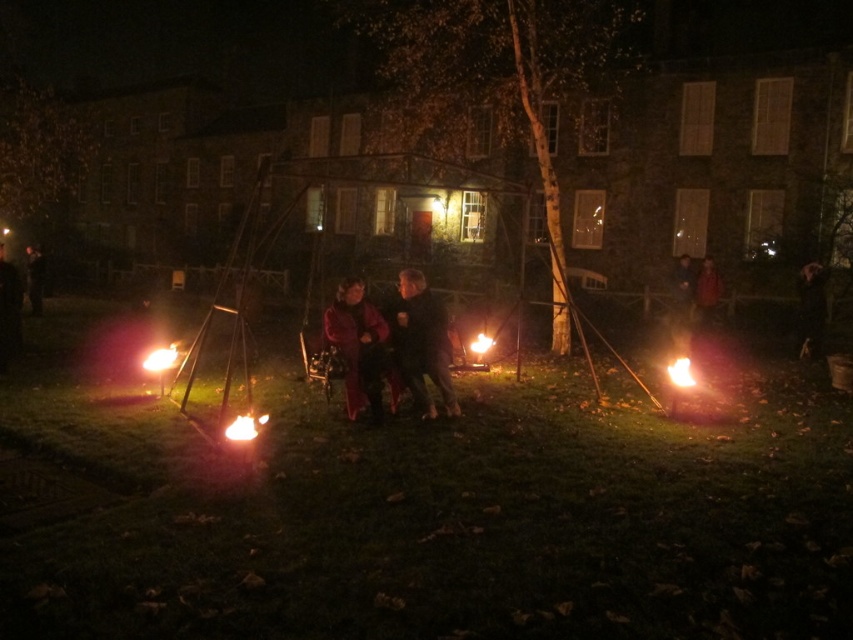
Question: Is dark brown leather jacket at center bigger than dark brown leather jacket at right?

Choices:
 (A) yes
 (B) no

Answer: (A)

Question: Which of these objects is positioned farthest from the smooth leather jacket at right?

Choices:
 (A) velvet red coat at center
 (B) dark brown leather jacket at right

Answer: (A)

Question: Is dark fabric coat at left bigger than flamered-orangefire at lower center?

Choices:
 (A) yes
 (B) no

Answer: (A)

Question: Which point appears closest to the camera in this image?

Choices:
 (A) (0, 296)
 (B) (33, 250)
 (C) (424, 291)
 (D) (711, 296)

Answer: (C)

Question: Is dark brown leather jacket at center positioned before velvet red coat at center?

Choices:
 (A) no
 (B) yes

Answer: (A)

Question: Considering the real-world distances, which object is closest to the matte black coat at center?

Choices:
 (A) smooth leather jacket at right
 (B) velvet red coat at center
 (C) dark brown leather jacket at center

Answer: (B)